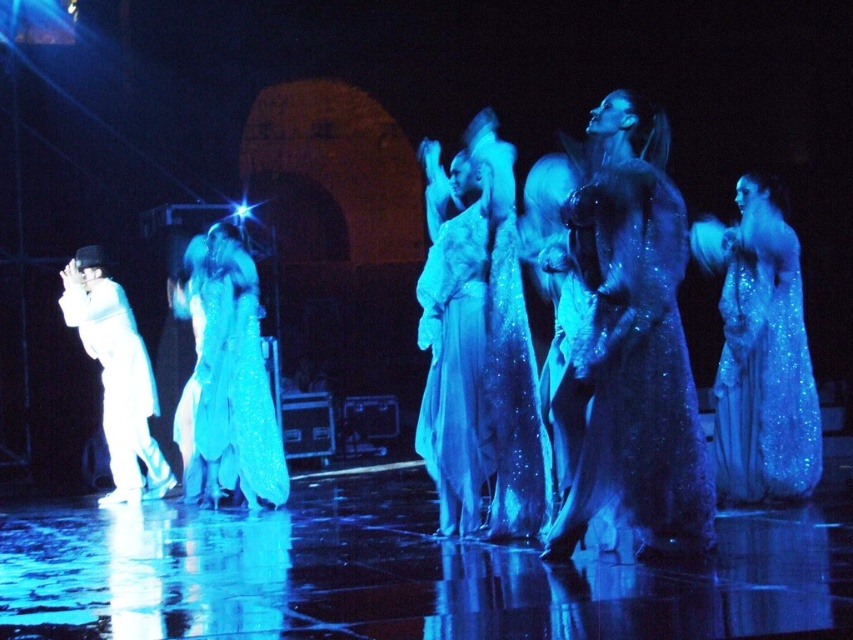
Does sparkly blue dress at right have a greater width compared to white glossy suit at left?

In fact, sparkly blue dress at right might be narrower than white glossy suit at left.

Does sparkly blue dress at right appear on the right side of white glossy suit at left?

Yes, sparkly blue dress at right is to the right of white glossy suit at left.

Between point (775, 372) and point (125, 460), which one is positioned in front?

Point (775, 372) is more forward.

This screenshot has height=640, width=853. Identify the location of sparkly blue dress at right. (761, 364).

Who is shorter, sparkly blue dress at center or white glossy suit at left?

sparkly blue dress at center

In order to click on sparkly blue dress at center in this screenshot , I will do `click(631, 368)`.

Identify the location of sparkly blue dress at center. (631, 368).

Can you confirm if sparkly blue dress at center is smaller than sparkly blue dress at right?

Correct, sparkly blue dress at center occupies less space than sparkly blue dress at right.

Can you confirm if sparkly blue dress at center is positioned below sparkly blue dress at right?

No, sparkly blue dress at center is not below sparkly blue dress at right.

Which is behind, point (628, 310) or point (738, 307)?

The point (738, 307) is more distant.

You are a GUI agent. You are given a task and a screenshot of the screen. Output one action in this format:
    pyautogui.click(x=<x>, y=<y>)
    Task: Click on the sparkly blue dress at center
    
    Given the screenshot: What is the action you would take?
    pyautogui.click(x=631, y=368)